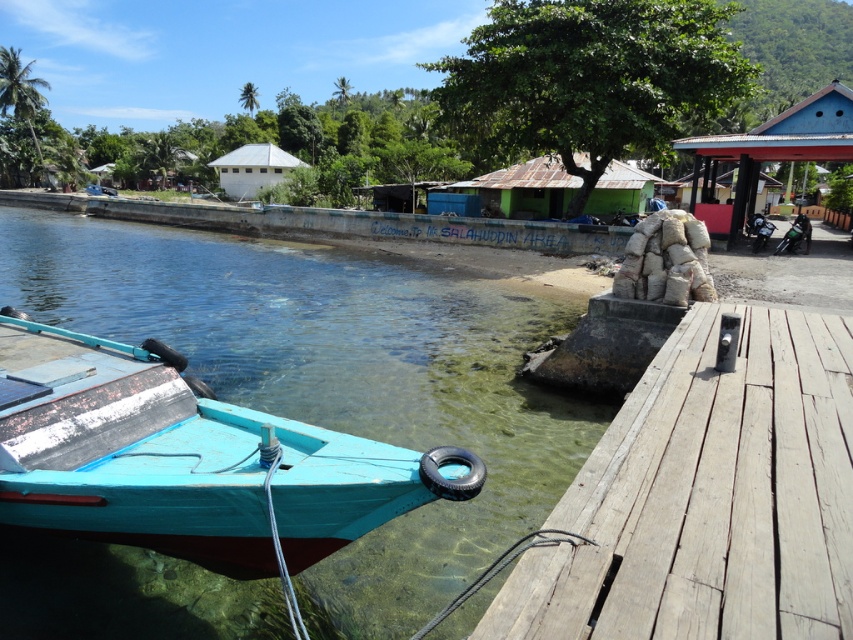
Question: Which of the following is the closest to the observer?

Choices:
 (A) blue corrugated metal hut at upper right
 (B) white matte hut at center

Answer: (A)

Question: Is wooden planks at right further to the viewer compared to teal wooden boat at lower left?

Choices:
 (A) no
 (B) yes

Answer: (B)

Question: Which of the following is the farthest from the observer?

Choices:
 (A) green corrugated metal hut at center
 (B) wooden planks at right
 (C) white matte hut at center
 (D) blue corrugated metal hut at upper right

Answer: (C)

Question: Is blue corrugated metal hut at upper right below white matte hut at center?

Choices:
 (A) no
 (B) yes

Answer: (B)

Question: Is wooden planks at right wider than teal wooden boat at lower left?

Choices:
 (A) yes
 (B) no

Answer: (B)

Question: Which point is closer to the camera taking this photo?

Choices:
 (A) (570, 182)
 (B) (683, 378)
 (C) (755, 161)

Answer: (B)